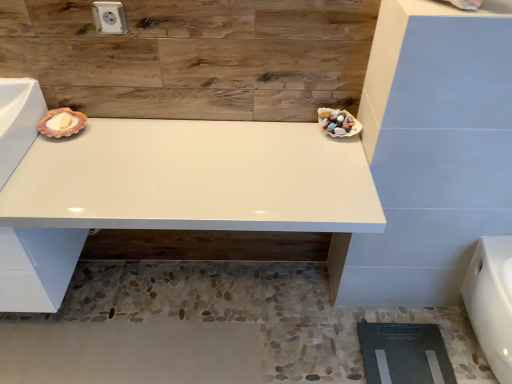
Identify the location of vacant space situated above white glossy vanity at center (from a real-world perspective). (165, 163).